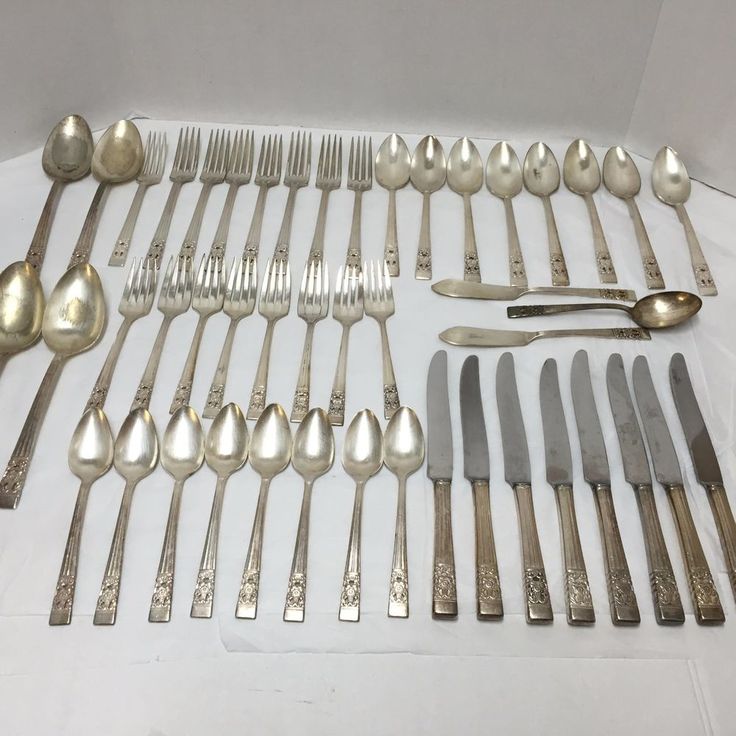
Where is `knives`? This screenshot has height=736, width=736. knives is located at coordinates (445, 434), (473, 436), (512, 439), (551, 441), (595, 445), (626, 445), (657, 445), (698, 431).